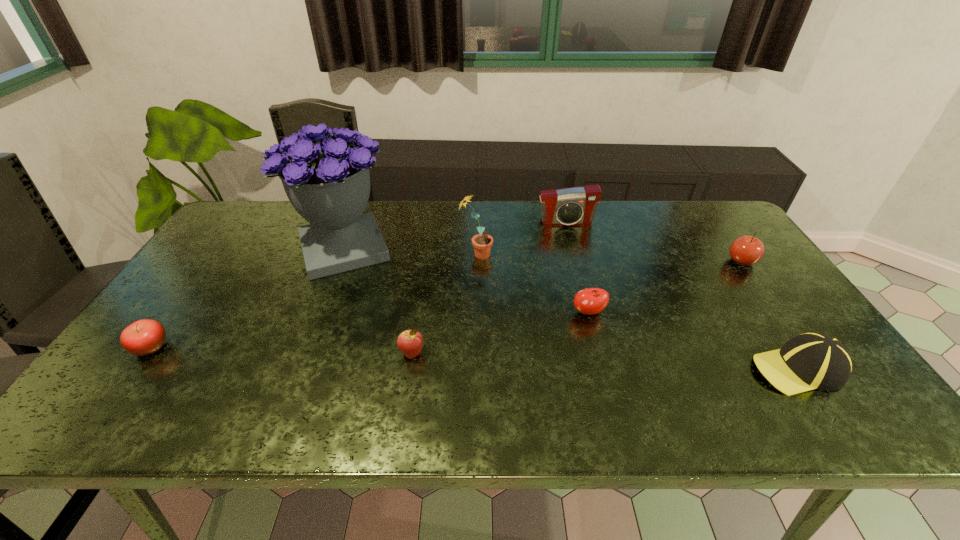
This screenshot has width=960, height=540. I want to click on free space at the left edge of the desktop, so click(225, 247).

This screenshot has height=540, width=960. In order to click on free location at the right edge in this screenshot , I will do `click(721, 285)`.

At what (x,y) coordinates should I click in order to perform the action: click on vacant area at the far left corner. Please return your answer as a coordinate pair (x, y). Image resolution: width=960 pixels, height=540 pixels. Looking at the image, I should click on (258, 203).

Where is `vacant position at the near left corner of the desktop`? This screenshot has height=540, width=960. vacant position at the near left corner of the desktop is located at coordinates (99, 401).

The height and width of the screenshot is (540, 960). Find the location of `vacant space at the near right corner of the desktop`. vacant space at the near right corner of the desktop is located at coordinates (816, 413).

The width and height of the screenshot is (960, 540). I want to click on free point between the farthest apple and the seventh object from right to left, so pos(542,255).

Locate an element on the screen. free space between the fourth nearest object and the third object from left to right is located at coordinates click(x=500, y=333).

Where is `free space between the fifth farthest object and the rightmost apple`? free space between the fifth farthest object and the rightmost apple is located at coordinates (665, 287).

At what (x,y) coordinates should I click in order to perform the action: click on free space between the third object from left to right and the camera. Please return your answer as a coordinate pair (x, y). Looking at the image, I should click on (490, 288).

You are a GUI agent. You are given a task and a screenshot of the screen. Output one action in this format:
    pyautogui.click(x=<x>, y=<y>)
    Task: Click on the free spot between the second tallest object and the baseball cap
    
    Given the screenshot: What is the action you would take?
    pyautogui.click(x=636, y=312)